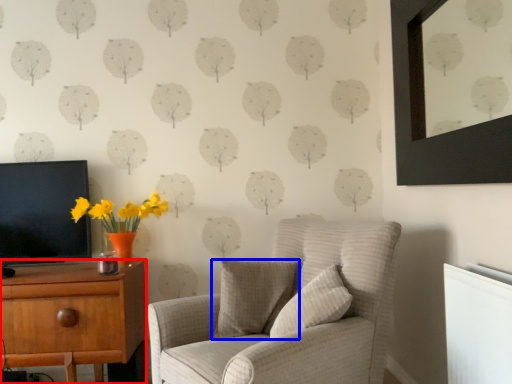
Question: Among these objects, which one is farthest to the camera, desk (highlighted by a red box) or pillow (highlighted by a blue box)?

Choices:
 (A) desk
 (B) pillow

Answer: (A)